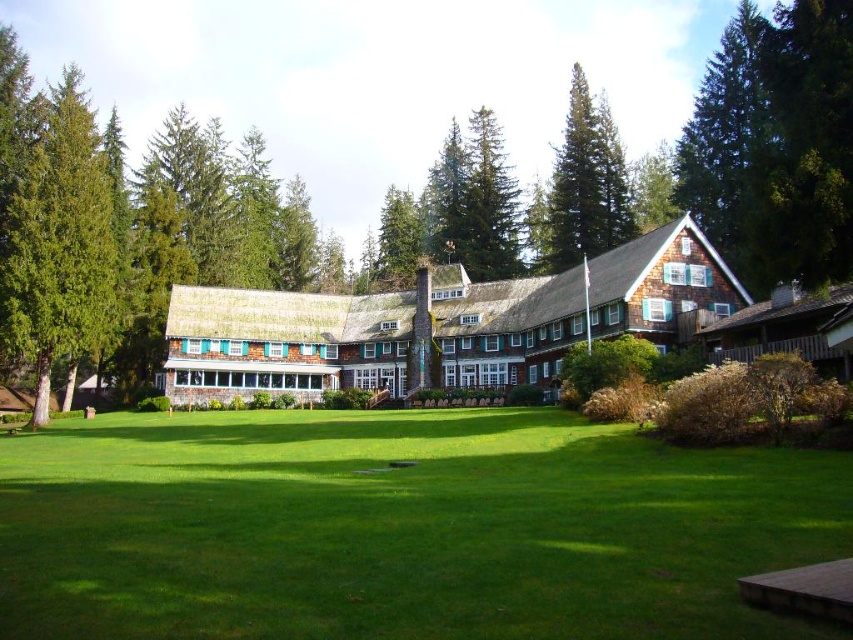
Does green grass at center appear over brown shingles at center?

No.

Does green grass at center have a greater width compared to brown shingles at center?

No, green grass at center is not wider than brown shingles at center.

Between point (13, 557) and point (294, 349), which one is positioned in front?

Point (13, 557)

Where is `green grass at center`? This screenshot has height=640, width=853. green grass at center is located at coordinates (401, 529).

Between brown shingles at center and green textured tree at left, which one appears on the left side from the viewer's perspective?

green textured tree at left is more to the left.

Between brown shingles at center and green textured tree at left, which one has more height?

Standing taller between the two is green textured tree at left.

Does point (381, 337) lie in front of point (28, 257)?

No, (381, 337) is behind (28, 257).

This screenshot has height=640, width=853. I want to click on brown shingles at center, so click(x=438, y=323).

Which is below, green textured tree at left or green shaggy pine at upper center?

Positioned lower is green shaggy pine at upper center.

Is point (79, 308) closer to camera compared to point (531, 241)?

That is True.

Which is behind, point (41, 118) or point (585, 188)?

The point (585, 188) is more distant.

What are the coordinates of `green textured tree at left` in the screenshot? It's located at (59, 241).